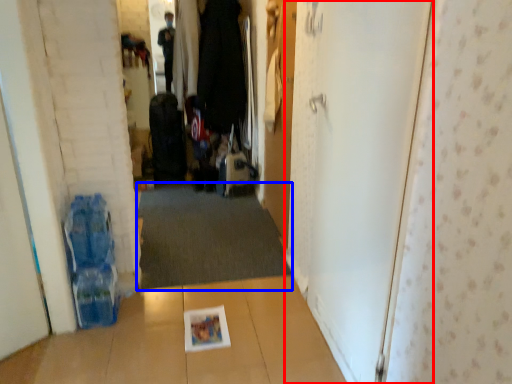
Question: Among these objects, which one is nearest to the camera, door (highlighted by a red box) or doormat (highlighted by a blue box)?

Choices:
 (A) door
 (B) doormat

Answer: (A)